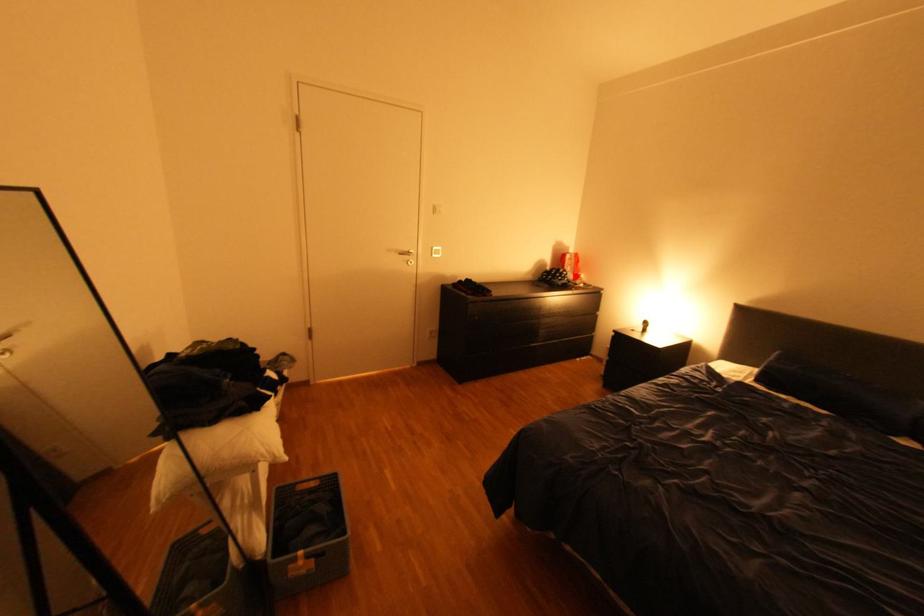
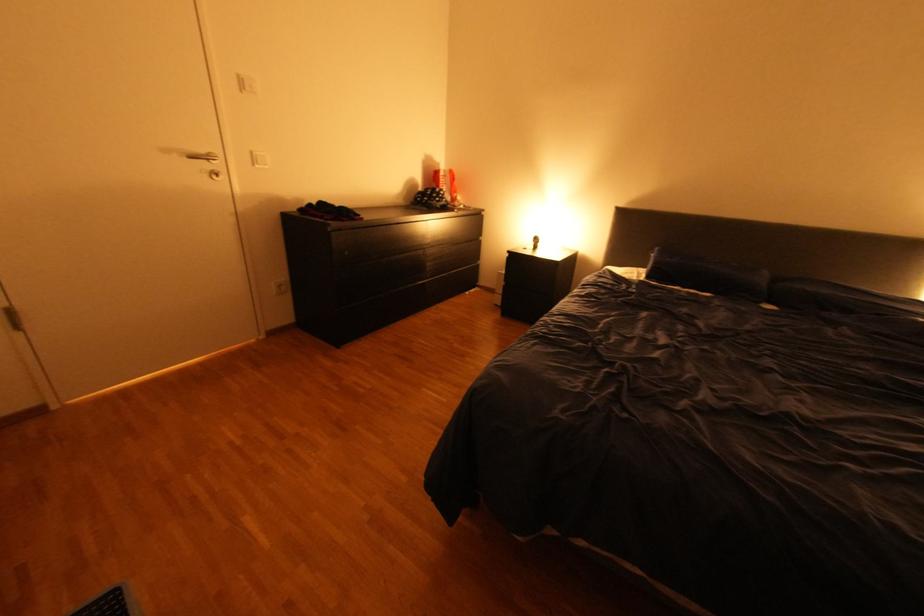
Find the pixel in the second image that matches the highlighted location in the first image.

(454, 196)